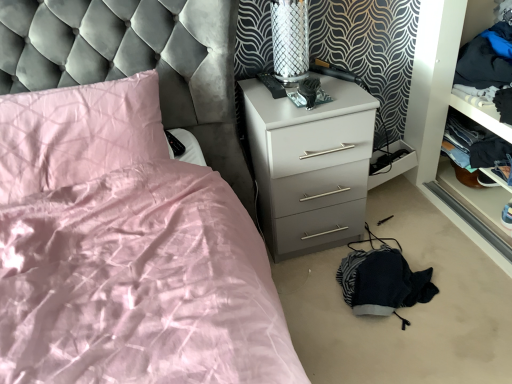
Question: From a real-world perspective, is white glossy chest of drawers at center below pink satin pillow at upper left?

Choices:
 (A) no
 (B) yes

Answer: (B)

Question: Is white glossy chest of drawers at center looking in the opposite direction of pink satin pillow at upper left?

Choices:
 (A) no
 (B) yes

Answer: (A)

Question: Is white glossy chest of drawers at center shorter than pink satin pillow at upper left?

Choices:
 (A) yes
 (B) no

Answer: (B)

Question: From a real-world perspective, is white glossy chest of drawers at center positioned over pink satin pillow at upper left based on gravity?

Choices:
 (A) no
 (B) yes

Answer: (A)

Question: Is white glossy chest of drawers at center thinner than pink satin pillow at upper left?

Choices:
 (A) yes
 (B) no

Answer: (B)

Question: Is the position of white glossy chest of drawers at center more distant than that of pink satin pillow at upper left?

Choices:
 (A) yes
 (B) no

Answer: (A)

Question: From a real-world perspective, is dark blue fabric at right, which ranks as the first clothing in top-to-bottom order, physically below dark blue fabric at right, which ranks as the 1th clothing in bottom-to-top order?

Choices:
 (A) no
 (B) yes

Answer: (A)

Question: Does dark blue fabric at right, which is the 2th clothing in bottom-to-top order, have a lesser height compared to dark blue fabric at right, which is the second clothing from top to bottom?

Choices:
 (A) yes
 (B) no

Answer: (B)

Question: Is dark blue fabric at right, which is the second clothing from top to bottom, surrounded by dark blue fabric at right, which ranks as the first clothing in top-to-bottom order?

Choices:
 (A) yes
 (B) no

Answer: (B)

Question: Is dark blue fabric at right, which is the 2th clothing in bottom-to-top order, positioned in front of dark blue fabric at right, which ranks as the 1th clothing in bottom-to-top order?

Choices:
 (A) yes
 (B) no

Answer: (A)

Question: Is dark blue fabric at right, which is the 2th clothing in bottom-to-top order, located outside dark blue fabric at right, which ranks as the 1th clothing in bottom-to-top order?

Choices:
 (A) yes
 (B) no

Answer: (A)

Question: Is dark blue fabric at right, which ranks as the first clothing in top-to-bottom order, oriented towards dark blue fabric at right, which is the second clothing from top to bottom?

Choices:
 (A) yes
 (B) no

Answer: (B)

Question: From a real-world perspective, is white glossy chest of drawers at center on dark blue fabric at right, which ranks as the first clothing in top-to-bottom order?

Choices:
 (A) no
 (B) yes

Answer: (A)